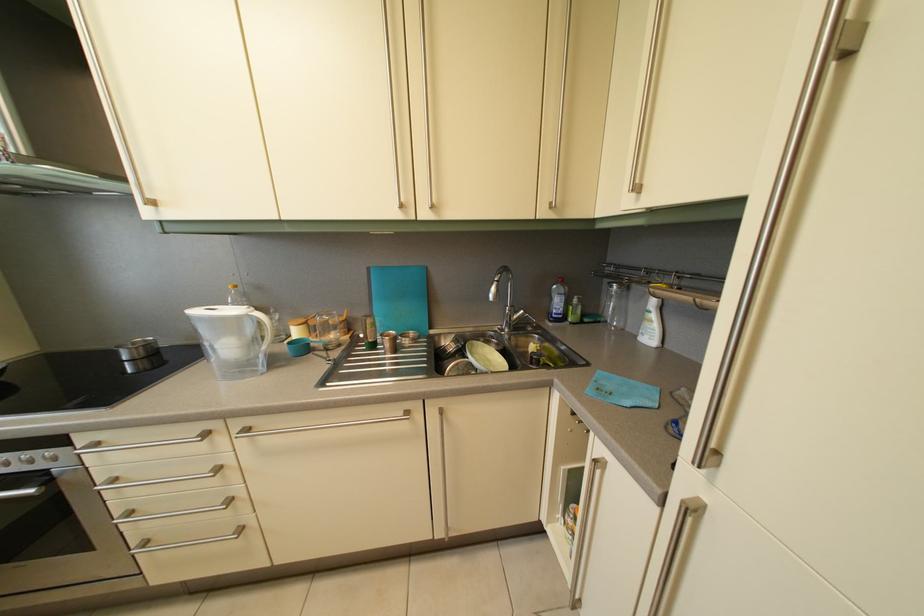
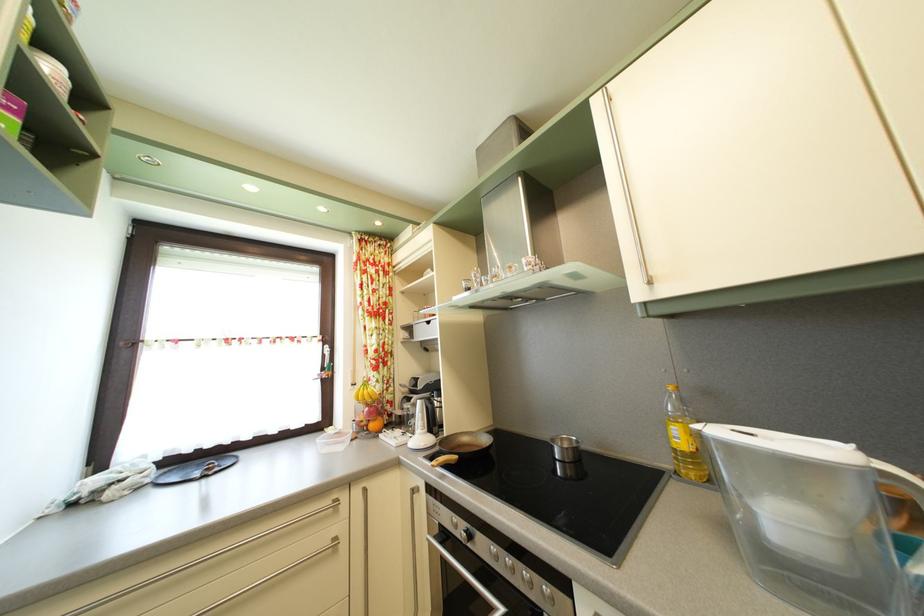
Question: I am providing you with two images of the same scene from different viewpoints. Please identify which objects are invisible in image2.

Choices:
 (A) pan handle
 (B) metal drawer handle
 (C) water pitcher handle
 (D) none of these

Answer: (D)